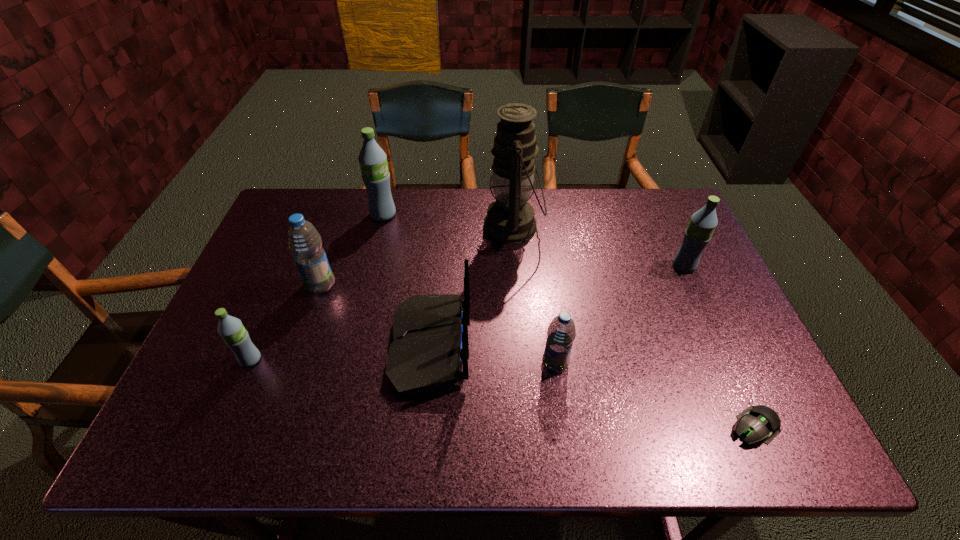
At what (x,y) coordinates should I click in order to perform the action: click on green water bottle that stands as the closest to the right blue water bottle. Please return your answer as a coordinate pair (x, y). The image size is (960, 540). Looking at the image, I should click on [x=702, y=224].

Where is `free point that satisfies the following two spatial constraints: 1. on the front side of the rightmost water bottle; 2. on the right side of the oil lamp`? free point that satisfies the following two spatial constraints: 1. on the front side of the rightmost water bottle; 2. on the right side of the oil lamp is located at coordinates (516, 266).